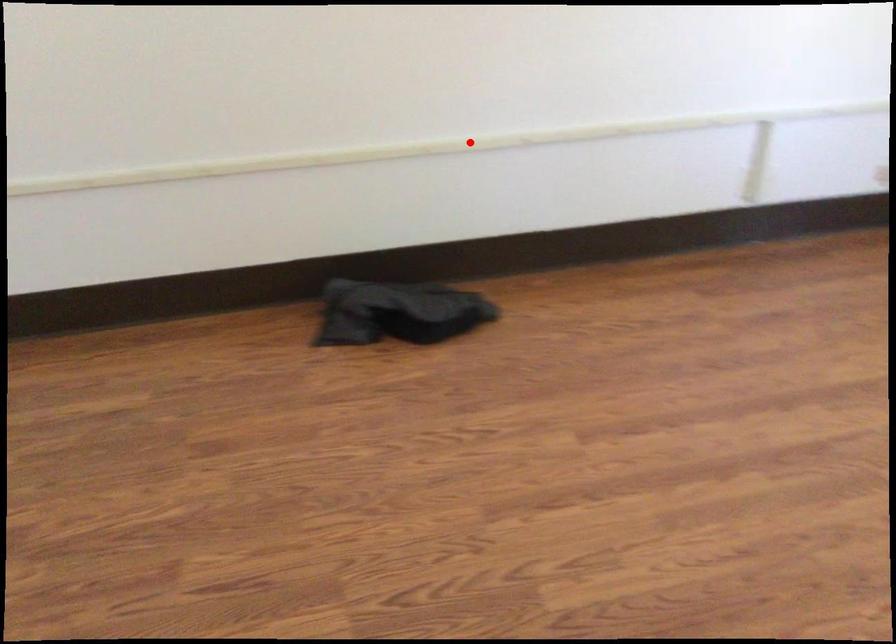
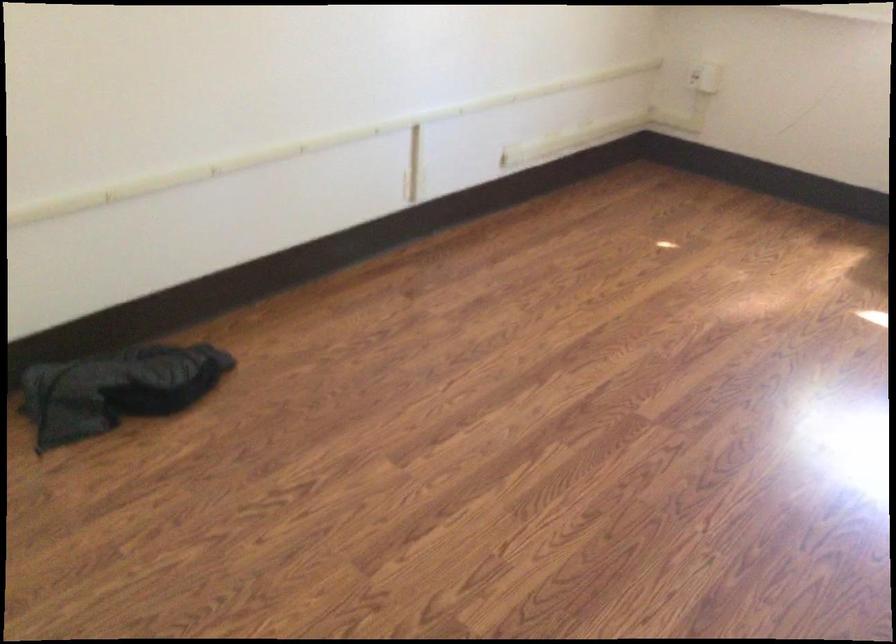
In the second image, find the point that corresponds to the highlighted location in the first image.

(159, 183)